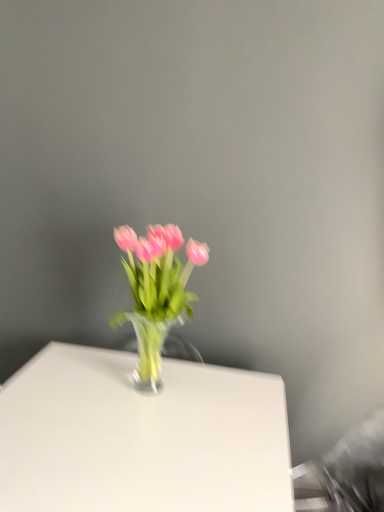
Identify the location of free point above white glossy table at center (from a real-world perspective). The width and height of the screenshot is (384, 512). (129, 414).